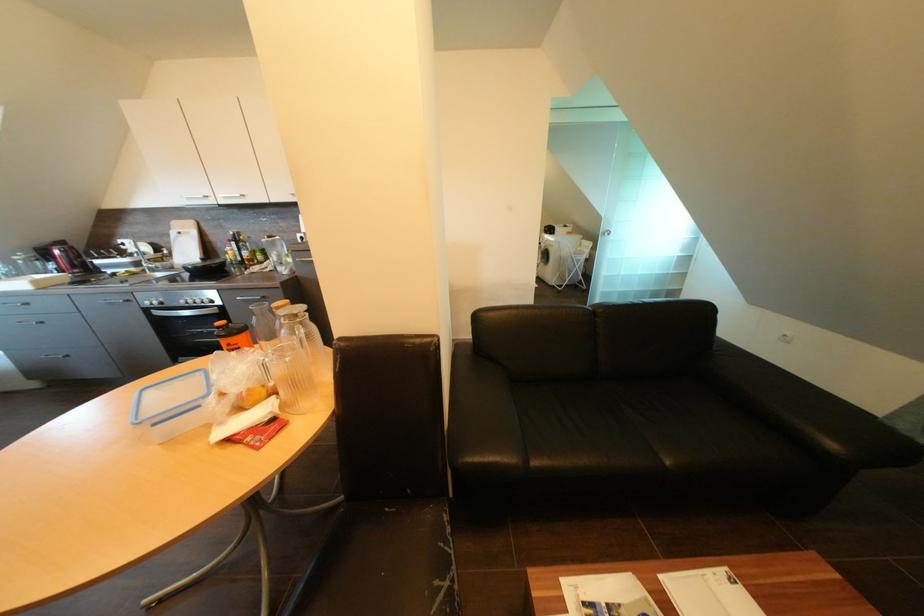
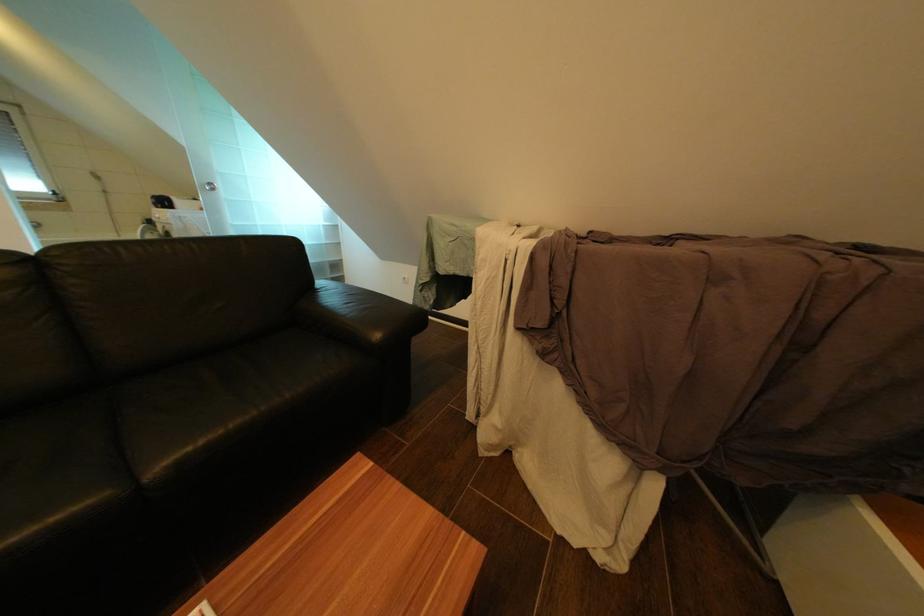
Question: The camera is either moving clockwise (left) or counter-clockwise (right) around the object. The first image is from the beginning of the video and the second image is from the end. Is the camera moving left or right when shooting the video?

Choices:
 (A) Left
 (B) Right

Answer: (A)